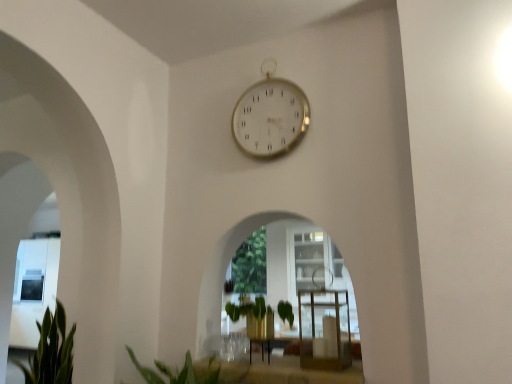
The image size is (512, 384). What do you see at coordinates (51, 351) in the screenshot?
I see `green leafy plant at lower left` at bounding box center [51, 351].

Locate an element on the screen. The width and height of the screenshot is (512, 384). green leafy plant at lower left is located at coordinates (51, 351).

What do you see at coordinates (270, 117) in the screenshot?
I see `gold metallic clock at upper center` at bounding box center [270, 117].

The width and height of the screenshot is (512, 384). What do you see at coordinates (250, 264) in the screenshot? I see `green leafy plant at center` at bounding box center [250, 264].

I want to click on green leafy plant at lower left, so click(x=51, y=351).

Which of these two, green leafy plant at lower left or gold metallic clock at upper center, stands shorter?

Standing shorter between the two is green leafy plant at lower left.

Could you tell me if green leafy plant at lower left is facing gold metallic clock at upper center?

No, green leafy plant at lower left is not oriented towards gold metallic clock at upper center.

Consider the image. Which is less distant, (72, 367) or (271, 153)?

Point (72, 367) is positioned farther from the camera compared to point (271, 153).

Consider the image. Which object is positioned more to the left, clear glass table at center or gold metallic clock at upper center?

gold metallic clock at upper center.

Who is shorter, clear glass table at center or gold metallic clock at upper center?

clear glass table at center.

Is clear glass table at center far from gold metallic clock at upper center?

Actually, clear glass table at center and gold metallic clock at upper center are a little close together.

Between clear glass table at center and gold metallic clock at upper center, which one has larger width?

With larger width is clear glass table at center.

In terms of height, does clear glass table at center look taller or shorter compared to green leafy plant at lower left?

Clearly, clear glass table at center is shorter compared to green leafy plant at lower left.

From the image's perspective, which is above, clear glass table at center or green leafy plant at lower left?

clear glass table at center is shown above in the image.

Does clear glass table at center have a smaller size compared to green leafy plant at lower left?

Yes, clear glass table at center is smaller than green leafy plant at lower left.

Can you confirm if green leafy plant at center is thinner than gold metallic clock at upper center?

Incorrect, the width of green leafy plant at center is not less than that of gold metallic clock at upper center.

Can you confirm if green leafy plant at center is bigger than gold metallic clock at upper center?

Yes.

Is green leafy plant at center placed right next to gold metallic clock at upper center?

green leafy plant at center and gold metallic clock at upper center are not in contact.

How distant is green leafy plant at center from gold metallic clock at upper center?

25.80 inches.

In terms of size, does green leafy plant at lower left appear bigger or smaller than green leafy plant at center?

Considering their sizes, green leafy plant at lower left takes up more space than green leafy plant at center.

Is green leafy plant at lower left not close to green leafy plant at center?

That's right, there is a large distance between green leafy plant at lower left and green leafy plant at center.

Considering the points (63, 383) and (240, 280), which point is in front, point (63, 383) or point (240, 280)?

The point (63, 383) is more forward.

Is green leafy plant at lower left shorter than green leafy plant at center?

Correct, green leafy plant at lower left is not as tall as green leafy plant at center.

Could you tell me if clear glass table at center is facing green leafy plant at center?

No, clear glass table at center is not aimed at green leafy plant at center.

Based on their sizes in the image, would you say clear glass table at center is bigger or smaller than green leafy plant at center?

clear glass table at center is smaller than green leafy plant at center.

From the image's perspective, is clear glass table at center on top of green leafy plant at center?

Yes, from the image's perspective, clear glass table at center is over green leafy plant at center.

From a real-world perspective, is green leafy plant at lower left positioned under clear glass table at center based on gravity?

Yes, from a real-world perspective, green leafy plant at lower left is under clear glass table at center.

The height and width of the screenshot is (384, 512). What are the coordinates of `table lying on the right of green leafy plant at lower left` in the screenshot? It's located at (319, 329).

Is green leafy plant at lower left in front of clear glass table at center?

No, the depth of green leafy plant at lower left is greater than that of clear glass table at center.

The image size is (512, 384). I want to click on plant that is on the left side of gold metallic clock at upper center, so click(51, 351).

This screenshot has width=512, height=384. What are the coordinates of `table on the right of gold metallic clock at upper center` in the screenshot? It's located at (319, 329).

Looking at the image, which one is located closer to gold metallic clock at upper center, clear glass table at center or green leafy plant at center?

green leafy plant at center is closer to gold metallic clock at upper center.

Looking at the image, which one is located closer to green leafy plant at center, green leafy plant at lower left or clear glass table at center?

clear glass table at center lies closer to green leafy plant at center than the other object.

In the scene shown: Considering their positions, is green leafy plant at center positioned further to clear glass table at center than gold metallic clock at upper center?

The object further to clear glass table at center is gold metallic clock at upper center.

When comparing their distances from green leafy plant at center, does clear glass table at center or green leafy plant at lower left seem further?

green leafy plant at lower left.

When comparing their distances from gold metallic clock at upper center, does green leafy plant at center or green leafy plant at lower left seem closer?

green leafy plant at center.

Which object lies further to the anchor point clear glass table at center, gold metallic clock at upper center or green leafy plant at lower left?

green leafy plant at lower left is further to clear glass table at center.

Based on the photo, estimate the real-world distances between objects in this image. Which object is closer to gold metallic clock at upper center, green leafy plant at lower left or green leafy plant at center?

Among the two, green leafy plant at center is located nearer to gold metallic clock at upper center.

Based on their spatial positions, is green leafy plant at lower left or green leafy plant at center closer to clear glass table at center?

green leafy plant at center is closer to clear glass table at center.

Image resolution: width=512 pixels, height=384 pixels. I want to click on wall clock situated between green leafy plant at lower left and clear glass table at center from left to right, so click(x=270, y=117).

Locate an element on the screen. Image resolution: width=512 pixels, height=384 pixels. wall clock between clear glass table at center and green leafy plant at center along the z-axis is located at coordinates (270, 117).

The height and width of the screenshot is (384, 512). Identify the location of plant between clear glass table at center and green leafy plant at center in the front-back direction. (51, 351).

Identify the location of wall clock between green leafy plant at lower left and green leafy plant at center along the z-axis. tap(270, 117).